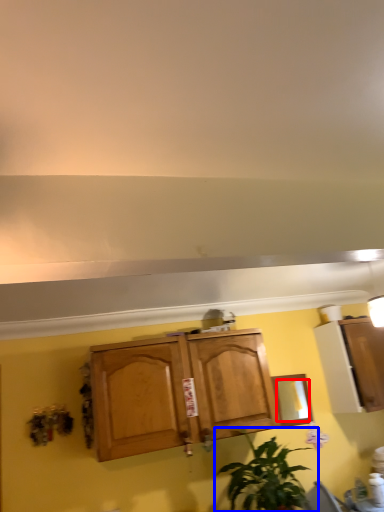
Question: Which object appears closest to the camera in this image, mirror (highlighted by a red box) or houseplant (highlighted by a blue box)?

Choices:
 (A) mirror
 (B) houseplant

Answer: (B)